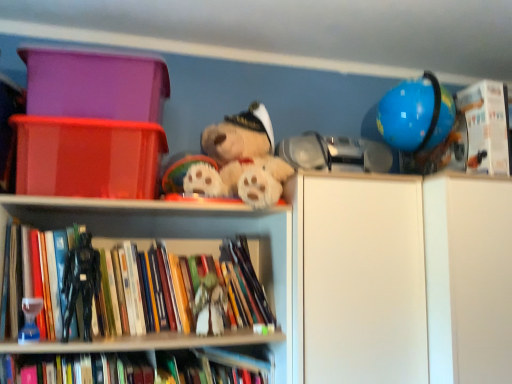
Question: Does hardcover book at center, positioned as the 3th book in top-to-bottom order, contain white matte figurine at center, acting as the first toy starting from the right?

Choices:
 (A) yes
 (B) no

Answer: (B)

Question: Considering the relative sizes of hardcover book at center, the 1th book in the bottom-to-top sequence, and white matte figurine at center, acting as the first toy starting from the right, in the image provided, is hardcover book at center, the 1th book in the bottom-to-top sequence, shorter than white matte figurine at center, acting as the first toy starting from the right,?

Choices:
 (A) yes
 (B) no

Answer: (B)

Question: Is hardcover book at center, the 1th book in the bottom-to-top sequence, oriented towards white matte figurine at center, positioned as the first toy in back-to-front order?

Choices:
 (A) no
 (B) yes

Answer: (A)

Question: Is hardcover book at center, the 2th book in the left-to-right sequence, not within white matte figurine at center, arranged as the second toy when viewed from the front?

Choices:
 (A) no
 (B) yes

Answer: (B)

Question: Does hardcover book at center, positioned as the 3th book in top-to-bottom order, have a larger size compared to white matte figurine at center, positioned as the first toy in back-to-front order?

Choices:
 (A) yes
 (B) no

Answer: (A)

Question: Does hardcover book at center, positioned as the second book in right-to-left order, lie behind white matte figurine at center, acting as the 2th toy starting from the left?

Choices:
 (A) yes
 (B) no

Answer: (B)

Question: Is white cardboard box at upper right, arranged as the first book when viewed from the right, at the right side of white matte cabinet at right?

Choices:
 (A) no
 (B) yes

Answer: (A)

Question: From the image's perspective, is white cardboard box at upper right, which ranks as the third book in left-to-right order, located beneath white matte cabinet at right?

Choices:
 (A) no
 (B) yes

Answer: (A)

Question: Is white cardboard box at upper right, which is the third book from bottom to top, outside white matte cabinet at right?

Choices:
 (A) no
 (B) yes

Answer: (B)

Question: Is white cardboard box at upper right, which is the third book from bottom to top, positioned with its back to white matte cabinet at right?

Choices:
 (A) no
 (B) yes

Answer: (A)

Question: Considering the relative sizes of white cardboard box at upper right, which is the third book from bottom to top, and white matte cabinet at right in the image provided, is white cardboard box at upper right, which is the third book from bottom to top, smaller than white matte cabinet at right?

Choices:
 (A) no
 (B) yes

Answer: (B)

Question: From a real-world perspective, is white cardboard box at upper right, which is the third book from bottom to top, over white matte cabinet at right?

Choices:
 (A) no
 (B) yes

Answer: (B)

Question: Does white matte cabinet at right have a smaller size compared to matte plastic storage box at upper left, which ranks as the first storage box in top-to-bottom order?

Choices:
 (A) yes
 (B) no

Answer: (B)